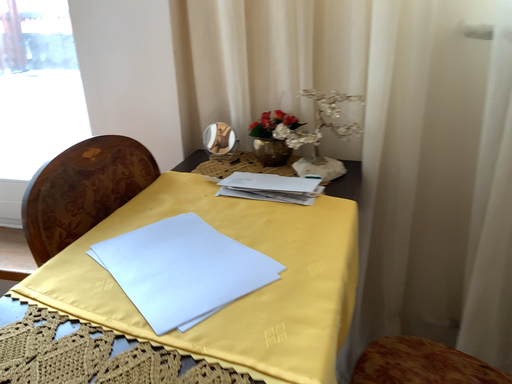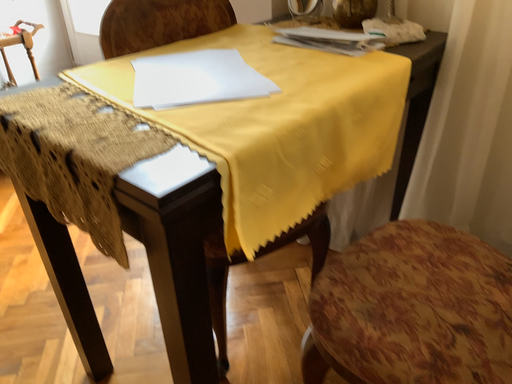
Question: Which way did the camera rotate in the video?

Choices:
 (A) rotated upward
 (B) rotated downward

Answer: (B)